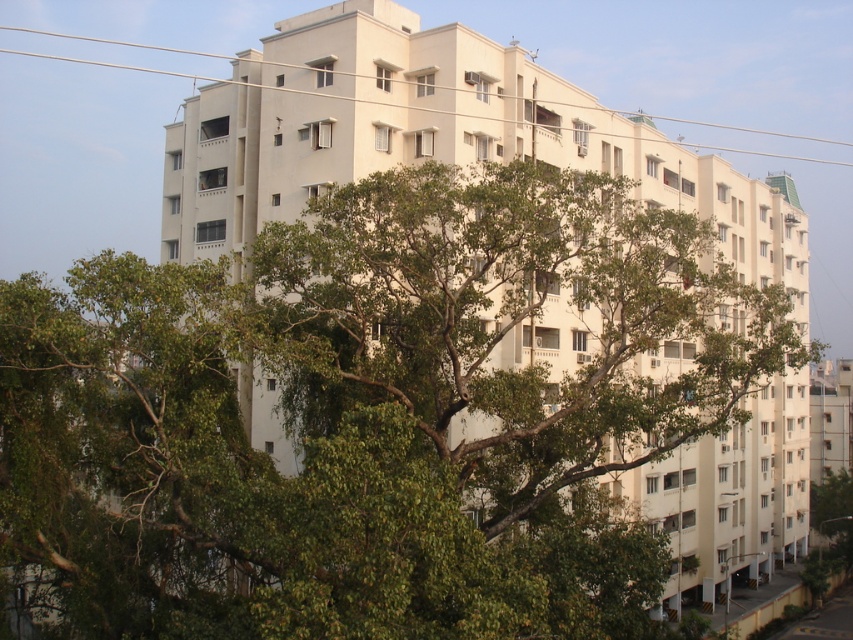
Is green leafy tree at center positioned before white plastic power line at upper center?

Yes.

Between point (189, 438) and point (840, 141), which one is positioned behind?

The point (840, 141) is more distant.

The height and width of the screenshot is (640, 853). I want to click on green leafy tree at center, so click(369, 417).